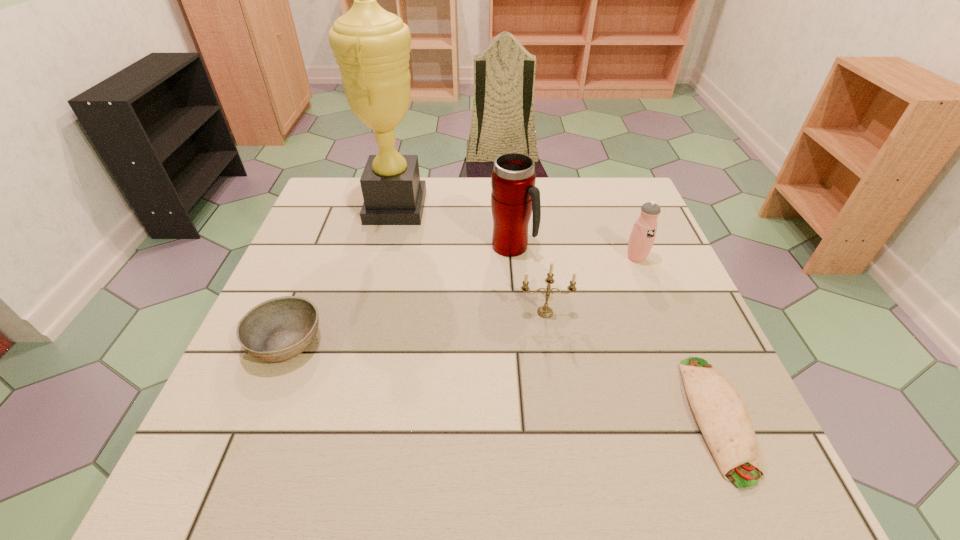
Locate an element on the screen. free space at the far edge is located at coordinates (444, 204).

Find the location of a particular element. free space at the near edge is located at coordinates click(337, 484).

The image size is (960, 540). Find the location of `vacant point at the left edge`. vacant point at the left edge is located at coordinates (328, 345).

Find the location of `free space at the right edge of the desktop`. free space at the right edge of the desktop is located at coordinates (715, 365).

This screenshot has width=960, height=540. In the image, there is a desktop. In order to click on vacant space at the far left corner in this screenshot , I will do `click(323, 195)`.

This screenshot has width=960, height=540. I want to click on vacant space at the far right corner of the desktop, so click(614, 187).

What are the coordinates of `free space between the trophy cup and the shortest object` in the screenshot? It's located at (557, 312).

Identify the location of free space between the burrito and the second shortest object. This screenshot has height=540, width=960. (502, 379).

The image size is (960, 540). In order to click on empty space between the right thermos bottle and the bowl in this screenshot , I will do `click(461, 300)`.

Find the location of `vacant space that is in between the burrito and the tallest object`. vacant space that is in between the burrito and the tallest object is located at coordinates (557, 312).